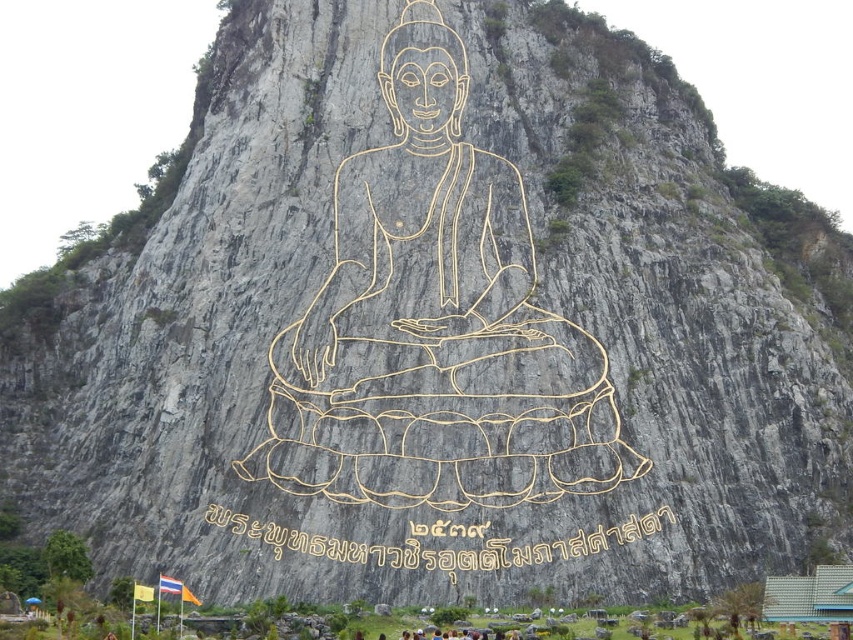
You are standing in front of the rock face with the Buddha carving. You notice two points marked in the image. The first point is at coordinates point [276,477] and the second is at point [291,531]. Which of these points is closer to you?

Point [291,531] is closer to you because point [276,477] is behind it.

You are a tour guide explaining the image to visitors. You want to highlight the relative sizes of the gold wire buddha at center and the yellow gold text at center. Without pointing directly at them, how would you describe their sizes in relation to each other?

The gold wire buddha at center is taller than the yellow gold text at center, so I would explain that the Buddha figure is significantly larger in height compared to the text below it.